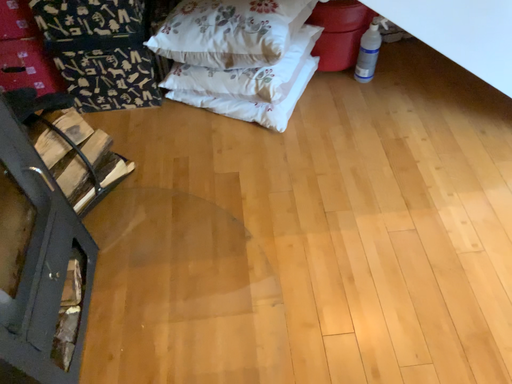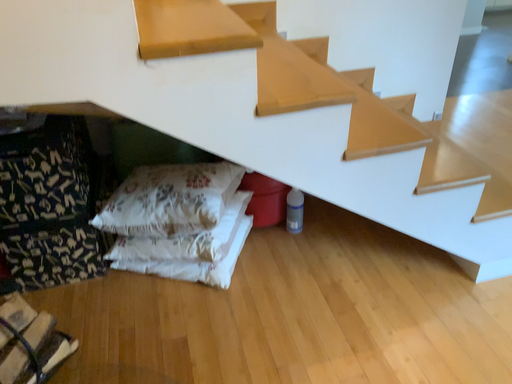
Question: How did the camera likely rotate when shooting the video?

Choices:
 (A) rotated upward
 (B) rotated downward

Answer: (A)